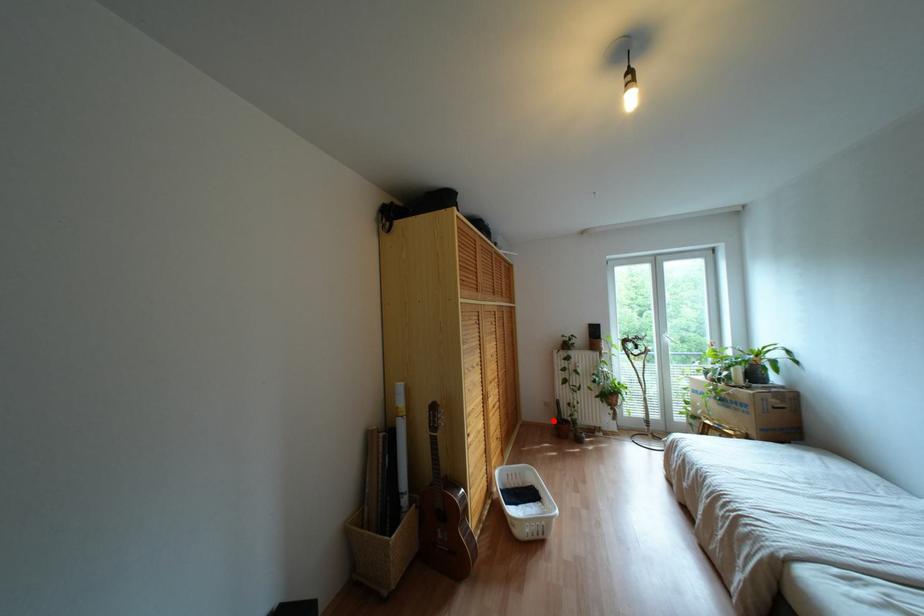
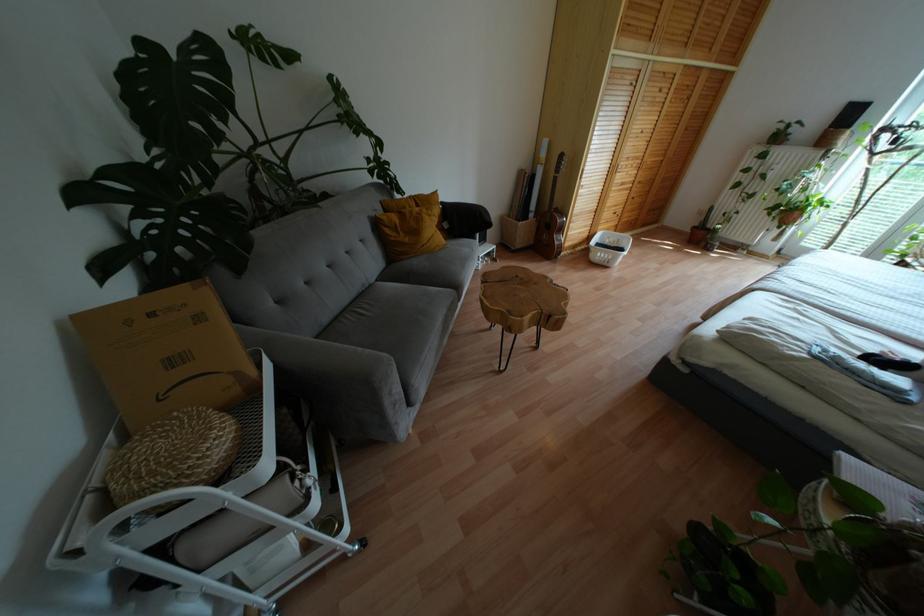
Question: I am providing you with two images of the same scene from different viewpoints. Image1 has a red point marked. In image2, the corresponding 3D location appears at what relative position? Reply with the corresponding letter.

Choices:
 (A) Closer
 (B) Farther

Answer: (A)